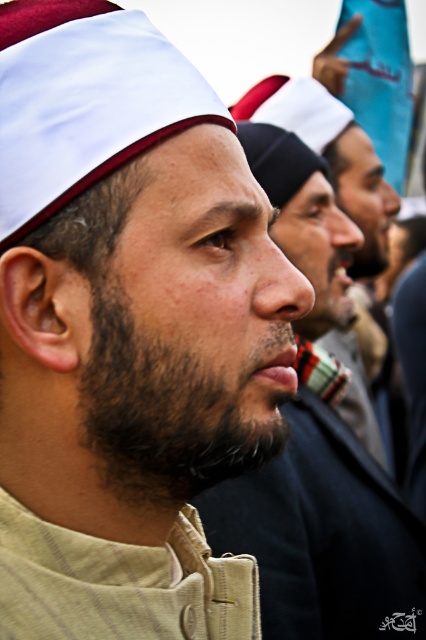
You are a photographer adjusting your camera settings to focus on the beige fabric cap at center and the beige fabric headscarf at center. Which object should you adjust your focus to first if you want to ensure both are in focus?

The beige fabric cap at center is closer to the viewer than the beige fabric headscarf at center, so you should focus on the beige fabric cap at center first to ensure both are in focus.

You are an artist trying to sketch the man in the center of the image. You need to decide which feature to draw first based on their vertical positions. Which one should you start with, the beige fabric cap at center or the dark brown fuzzy beard at center?

The beige fabric cap at center has a greater height compared to the dark brown fuzzy beard at center, so you should start with the beige fabric cap at center as it is positioned higher up.

Consider the image. You are a photographer trying to adjust the focus of your camera to capture the beige fabric cap at center and the dark brown fuzzy beard at center. Which object should you focus on first if you want to ensure both are in focus?

The beige fabric cap at center is located above the dark brown fuzzy beard at center. To ensure both are in focus, you should focus on the dark brown fuzzy beard at center first, as it is closer to the camera, and the cap will naturally come into focus as it is further away but still within the depth of field.